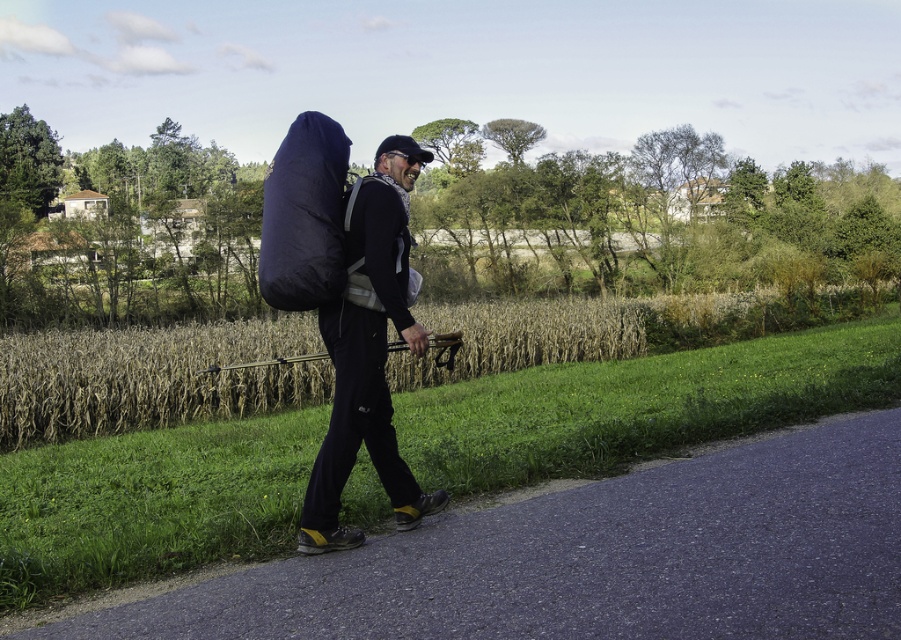
Does asphalt road at center have a larger size compared to matte black backpack at center?

Incorrect, asphalt road at center is not larger than matte black backpack at center.

The height and width of the screenshot is (640, 901). Describe the element at coordinates (584, 557) in the screenshot. I see `asphalt road at center` at that location.

The width and height of the screenshot is (901, 640). I want to click on asphalt road at center, so click(x=584, y=557).

Is matte black backpack at center shorter than navy blue fabric sleeping bag at upper center?

Yes.

Who is taller, matte black backpack at center or navy blue fabric sleeping bag at upper center?

navy blue fabric sleeping bag at upper center is taller.

Is point (372, 387) less distant than point (334, 220)?

No.

Where is `matte black backpack at center`? This screenshot has height=640, width=901. matte black backpack at center is located at coordinates (369, 352).

Which of these two, asphalt road at center or navy blue fabric sleeping bag at upper center, stands taller?

navy blue fabric sleeping bag at upper center is taller.

Between asphalt road at center and navy blue fabric sleeping bag at upper center, which one appears on the left side from the viewer's perspective?

navy blue fabric sleeping bag at upper center is more to the left.

This screenshot has height=640, width=901. Find the location of `asphalt road at center`. asphalt road at center is located at coordinates (584, 557).

The width and height of the screenshot is (901, 640). I want to click on asphalt road at center, so click(584, 557).